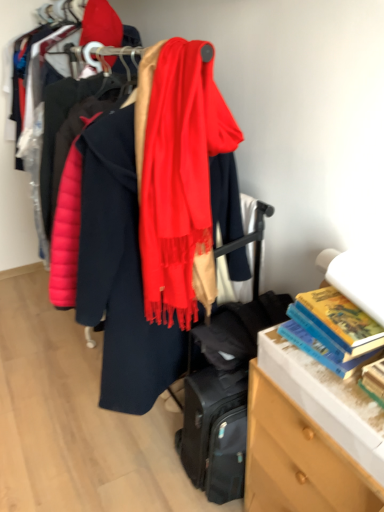
In order to click on hardcover book at right, the first book when ordered from front to back in this screenshot , I will do click(x=374, y=380).

Measure the distance between hardcover book at right, the 1th book positioned from the back, and camera.

They are 37.34 inches apart.

What do you see at coordinates (178, 176) in the screenshot?
I see `silky red scarf at center` at bounding box center [178, 176].

The height and width of the screenshot is (512, 384). What are the coordinates of `hardcover book at right, the first book when ordered from front to back` in the screenshot? It's located at (374, 380).

Considering the sizes of objects wooden chest of drawers at lower right and silky red scarf at center in the image provided, who is bigger, wooden chest of drawers at lower right or silky red scarf at center?

With larger size is wooden chest of drawers at lower right.

Considering the sizes of objects wooden chest of drawers at lower right and silky red scarf at center in the image provided, who is thinner, wooden chest of drawers at lower right or silky red scarf at center?

silky red scarf at center is thinner.

Which of these two, wooden chest of drawers at lower right or silky red scarf at center, stands shorter?

With less height is wooden chest of drawers at lower right.

Is wooden chest of drawers at lower right not close to silky red scarf at center?

No, there isn't a large distance between wooden chest of drawers at lower right and silky red scarf at center.

Is wooden chest of drawers at lower right thinner than hardcover book at right, the 1th book positioned from the back?

No, wooden chest of drawers at lower right is not thinner than hardcover book at right, the 1th book positioned from the back.

Who is bigger, wooden chest of drawers at lower right or hardcover book at right, the 1th book positioned from the back?

wooden chest of drawers at lower right is bigger.

Relative to hardcover book at right, the second book viewed from the front, is wooden chest of drawers at lower right in front or behind?

wooden chest of drawers at lower right is positioned closer to the viewer than hardcover book at right, the second book viewed from the front.

Is wooden chest of drawers at lower right touching hardcover book at right, the second book viewed from the front?

They are not placed beside each other.

Is hardcover book at right, the second book viewed from the front, completely or partially inside hardcover book at right, acting as the second book starting from the back?

That's incorrect, hardcover book at right, the second book viewed from the front, is not inside hardcover book at right, acting as the second book starting from the back.

Does hardcover book at right, acting as the second book starting from the back, have a smaller size compared to hardcover book at right, the second book viewed from the front?

Yes, hardcover book at right, acting as the second book starting from the back, is smaller than hardcover book at right, the second book viewed from the front.

Considering the positions of objects hardcover book at right, the first book when ordered from front to back, and hardcover book at right, the 1th book positioned from the back, in the image provided, who is in front, hardcover book at right, the first book when ordered from front to back, or hardcover book at right, the 1th book positioned from the back,?

hardcover book at right, the first book when ordered from front to back, is closer to the camera.

Where is `book on the left of hardcover book at right, acting as the second book starting from the back`? book on the left of hardcover book at right, acting as the second book starting from the back is located at coordinates coord(332,330).

Can we say hardcover book at right, the second book viewed from the front, lies outside silky red scarf at center?

That's correct, hardcover book at right, the second book viewed from the front, is outside of silky red scarf at center.

Is point (324, 340) behind point (201, 102)?

Yes, it is behind point (201, 102).

Measure the distance between hardcover book at right, the 1th book positioned from the back, and silky red scarf at center.

hardcover book at right, the 1th book positioned from the back, is 16.77 inches from silky red scarf at center.

Based on the photo, from the image's perspective, is hardcover book at right, the 1th book positioned from the back, located above or below silky red scarf at center?

hardcover book at right, the 1th book positioned from the back, is below silky red scarf at center.

Which object is more forward, hardcover book at right, the second book viewed from the front, or wooden chest of drawers at lower right?

wooden chest of drawers at lower right is more forward.

From a real-world perspective, who is located higher, hardcover book at right, the 1th book positioned from the back, or wooden chest of drawers at lower right?

From a 3D spatial view, hardcover book at right, the 1th book positioned from the back, is above.

Consider the image. Could you tell me if hardcover book at right, the second book viewed from the front, is turned towards wooden chest of drawers at lower right?

No.

Would you say hardcover book at right, the second book viewed from the front, is inside or outside wooden chest of drawers at lower right?

hardcover book at right, the second book viewed from the front, is spatially situated outside wooden chest of drawers at lower right.

Identify the location of scarf above the hardcover book at right, the 1th book positioned from the back (from the image's perspective). (178, 176).

Does silky red scarf at center have a greater height compared to hardcover book at right, the second book viewed from the front?

Yes.

From the picture: Considering the positions of objects silky red scarf at center and hardcover book at right, the second book viewed from the front, in the image provided, who is more to the right, silky red scarf at center or hardcover book at right, the second book viewed from the front,?

From the viewer's perspective, hardcover book at right, the second book viewed from the front, appears more on the right side.

Considering the relative sizes of silky red scarf at center and hardcover book at right, the 1th book positioned from the back, in the image provided, is silky red scarf at center bigger than hardcover book at right, the 1th book positioned from the back,?

Yes.

From the image's perspective, would you say wooden chest of drawers at lower right is positioned over hardcover book at right, acting as the second book starting from the back?

No, from the image's perspective, wooden chest of drawers at lower right is not over hardcover book at right, acting as the second book starting from the back.

Is wooden chest of drawers at lower right smaller than hardcover book at right, the first book when ordered from front to back?

Actually, wooden chest of drawers at lower right might be larger than hardcover book at right, the first book when ordered from front to back.

Can you confirm if wooden chest of drawers at lower right is shorter than hardcover book at right, the first book when ordered from front to back?

No.

Is point (278, 504) less distant than point (375, 379)?

No.

Find the location of a particular element. This screenshot has width=384, height=512. scarf above the wooden chest of drawers at lower right (from a real-world perspective) is located at coordinates (178, 176).

Where is `the chest of drawers that is below the hardcover book at right, the second book viewed from the front (from the image's perspective)`? The image size is (384, 512). the chest of drawers that is below the hardcover book at right, the second book viewed from the front (from the image's perspective) is located at coordinates (298, 459).

From the image, which object appears to be nearer to wooden chest of drawers at lower right, hardcover book at right, the first book when ordered from front to back, or hardcover book at right, the 1th book positioned from the back?

hardcover book at right, the 1th book positioned from the back, lies closer to wooden chest of drawers at lower right than the other object.

Looking at the image, which one is located closer to hardcover book at right, the 1th book positioned from the back, wooden chest of drawers at lower right or silky red scarf at center?

wooden chest of drawers at lower right is positioned closer to the anchor hardcover book at right, the 1th book positioned from the back.

From the picture: From the image, which object appears to be nearer to silky red scarf at center, hardcover book at right, the second book viewed from the front, or hardcover book at right, acting as the second book starting from the back?

hardcover book at right, the second book viewed from the front.

Estimate the real-world distances between objects in this image. Which object is further from silky red scarf at center, hardcover book at right, the first book when ordered from front to back, or hardcover book at right, the second book viewed from the front?

hardcover book at right, the first book when ordered from front to back.

Considering their positions, is hardcover book at right, the second book viewed from the front, positioned closer to hardcover book at right, the first book when ordered from front to back, than silky red scarf at center?

hardcover book at right, the second book viewed from the front, is positioned closer to the anchor hardcover book at right, the first book when ordered from front to back.

Estimate the real-world distances between objects in this image. Which object is closer to hardcover book at right, acting as the second book starting from the back, silky red scarf at center or wooden chest of drawers at lower right?

Based on the image, wooden chest of drawers at lower right appears to be nearer to hardcover book at right, acting as the second book starting from the back.

From the image, which object appears to be farther from hardcover book at right, the first book when ordered from front to back, hardcover book at right, the second book viewed from the front, or wooden chest of drawers at lower right?

Based on the image, wooden chest of drawers at lower right appears to be further to hardcover book at right, the first book when ordered from front to back.

Considering their positions, is wooden chest of drawers at lower right positioned further to silky red scarf at center than hardcover book at right, the 1th book positioned from the back?

Among the two, wooden chest of drawers at lower right is located further to silky red scarf at center.

Locate an element on the screen. This screenshot has width=384, height=512. book located between silky red scarf at center and hardcover book at right, acting as the second book starting from the back, in the left-right direction is located at coordinates (332, 330).

This screenshot has height=512, width=384. I want to click on book between hardcover book at right, the second book viewed from the front, and wooden chest of drawers at lower right in the up-down direction, so click(374, 380).